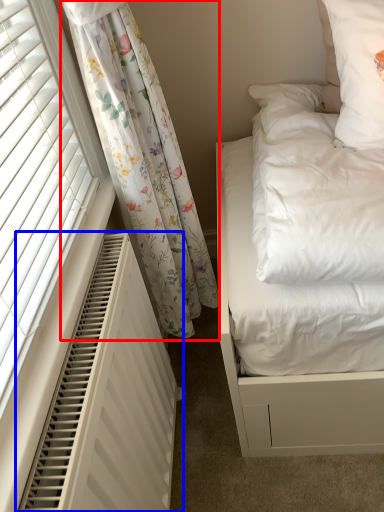
Question: Which object is closer to the camera taking this photo, curtain (highlighted by a red box) or air conditioner (highlighted by a blue box)?

Choices:
 (A) curtain
 (B) air conditioner

Answer: (B)